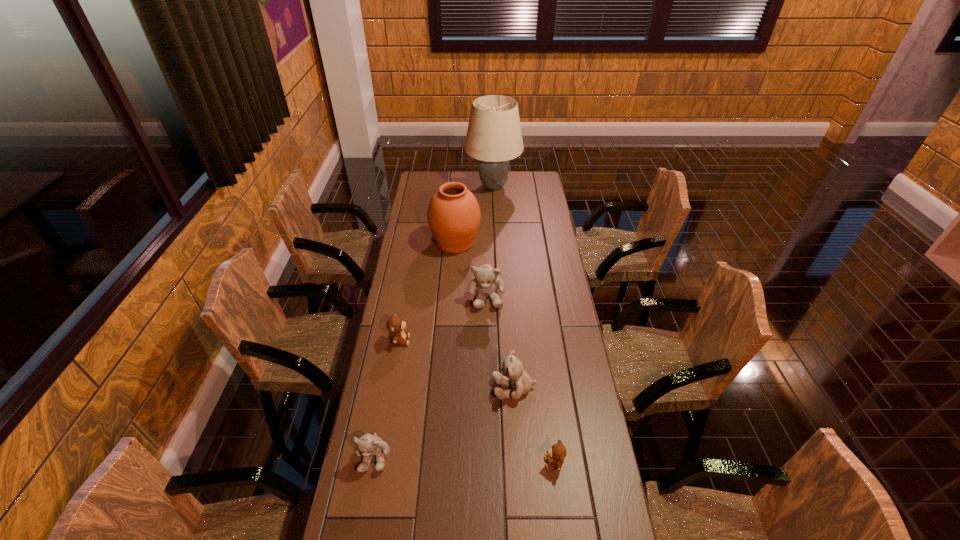
The image size is (960, 540). Find the location of `lampshade`. lampshade is located at coordinates click(494, 136).

The height and width of the screenshot is (540, 960). What are the coordinates of `white lampshade` in the screenshot? It's located at (494, 136).

The height and width of the screenshot is (540, 960). What are the coordinates of `the second tallest object` in the screenshot? It's located at (453, 215).

The image size is (960, 540). Find the location of `the second farthest object`. the second farthest object is located at coordinates (453, 215).

Locate an element on the screen. This screenshot has height=540, width=960. the farthest teddy bear is located at coordinates (485, 282).

This screenshot has height=540, width=960. Find the location of `the biggest gray teddy bear`. the biggest gray teddy bear is located at coordinates (485, 282).

The width and height of the screenshot is (960, 540). Find the location of `the third nearest object`. the third nearest object is located at coordinates (515, 376).

Identify the location of the third nearest teddy bear. (515, 376).

Locate an element on the screen. the fourth nearest object is located at coordinates (395, 325).

Locate an element on the screen. The width and height of the screenshot is (960, 540). the bigger brown teddy bear is located at coordinates (395, 325).